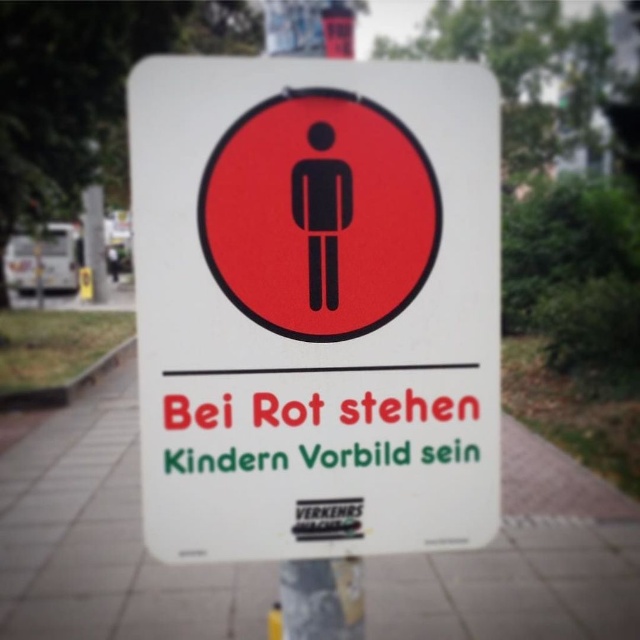
Question: Considering the relative positions of white plastic sign at center and white concrete pavement at center in the image provided, where is white plastic sign at center located with respect to white concrete pavement at center?

Choices:
 (A) below
 (B) above

Answer: (B)

Question: Can you confirm if white plastic sign at center is positioned to the right of white concrete pavement at center?

Choices:
 (A) yes
 (B) no

Answer: (A)

Question: Is white plastic sign at center smaller than white concrete pavement at center?

Choices:
 (A) no
 (B) yes

Answer: (A)

Question: Which point is farther to the camera?

Choices:
 (A) white plastic sign at center
 (B) white concrete pavement at center

Answer: (B)